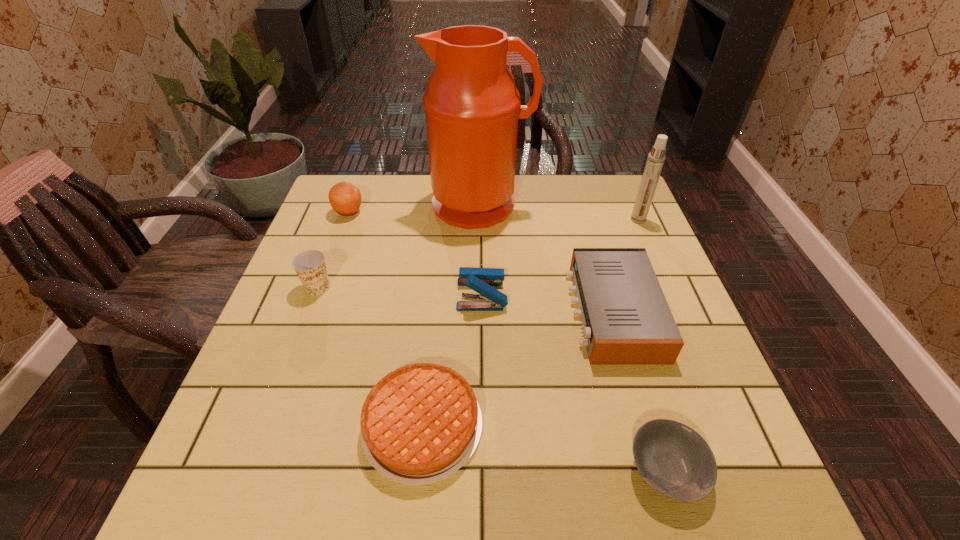
This screenshot has width=960, height=540. I want to click on water jug, so click(472, 107).

At what (x,y) coordinates should I click in order to perform the action: click on aerosol can. Please return your answer as a coordinate pair (x, y). This screenshot has width=960, height=540. Looking at the image, I should click on (654, 164).

Identify the location of the rightmost object. This screenshot has width=960, height=540. (654, 164).

Find the location of a particular element. orange is located at coordinates 345,199.

Where is `stapler`? The height and width of the screenshot is (540, 960). stapler is located at coordinates (481, 280).

You are a GUI agent. You are given a task and a screenshot of the screen. Output one action in this format:
    pyautogui.click(x=<x>, y=<y>)
    Task: Click on the Dixie cup
    The width and height of the screenshot is (960, 540).
    Given the screenshot: What is the action you would take?
    pyautogui.click(x=310, y=266)

This screenshot has height=540, width=960. Identify the location of radio receiver. (626, 320).

At what (x,y) coordinates should I click in order to perform the action: click on pie. Please return your answer as a coordinate pair (x, y). The image size is (960, 540). Looking at the image, I should click on (420, 423).

This screenshot has height=540, width=960. I want to click on bowl, so click(x=675, y=460).

You are a GUI agent. You are given a task and a screenshot of the screen. Output one action in this format:
    pyautogui.click(x=<x>, y=<y>)
    Task: Click on the blank space located 0.110m from the spout of the water jug
    This screenshot has height=540, width=960.
    Given the screenshot: What is the action you would take?
    pyautogui.click(x=480, y=256)